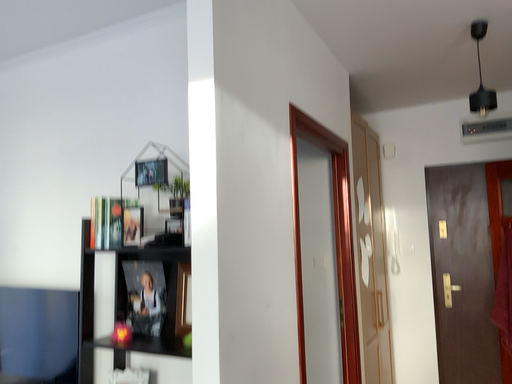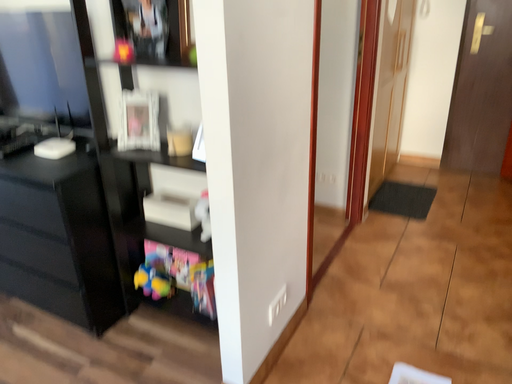
Question: Which way did the camera rotate in the video?

Choices:
 (A) rotated downward
 (B) rotated upward

Answer: (A)